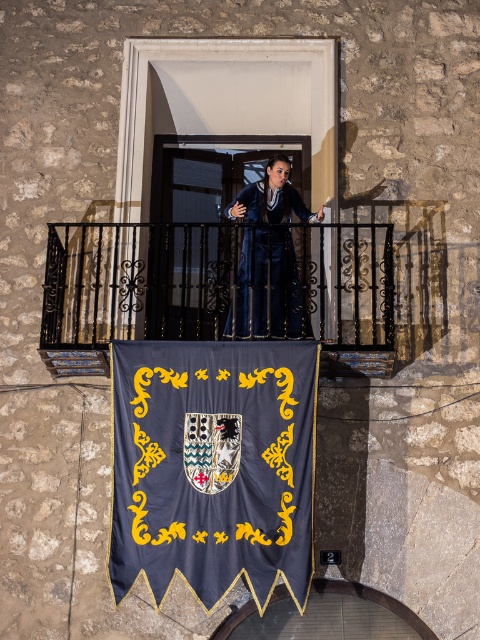
You are standing on the balcony and want to hang a new decorative item. The dark blue fabric banner at center is represented by point (213, 467). Where should you place your new item so it is directly above the banner?

Place the new item at a point with the same x coordinate as the dark blue fabric banner at center, which is 0.730, and a y coordinate lower than 0.444 to be directly above it.

You are standing 100 feet away from the stone wall and want to throw a small object to hit the dark blue fabric banner at center. Is the distance within your throwing range?

The dark blue fabric banner at center is 82.51 feet away from the camera, so yes, it is within your throwing range if you can throw up to 100 feet.

You are a painter standing on the balcony and want to paint the dark blue fabric banner at center and the black wrought iron balustrade at center. Which object is positioned higher from the ground?

The black wrought iron balustrade at center is positioned higher from the ground than the dark blue fabric banner at center, as the banner is located below the balustrade.